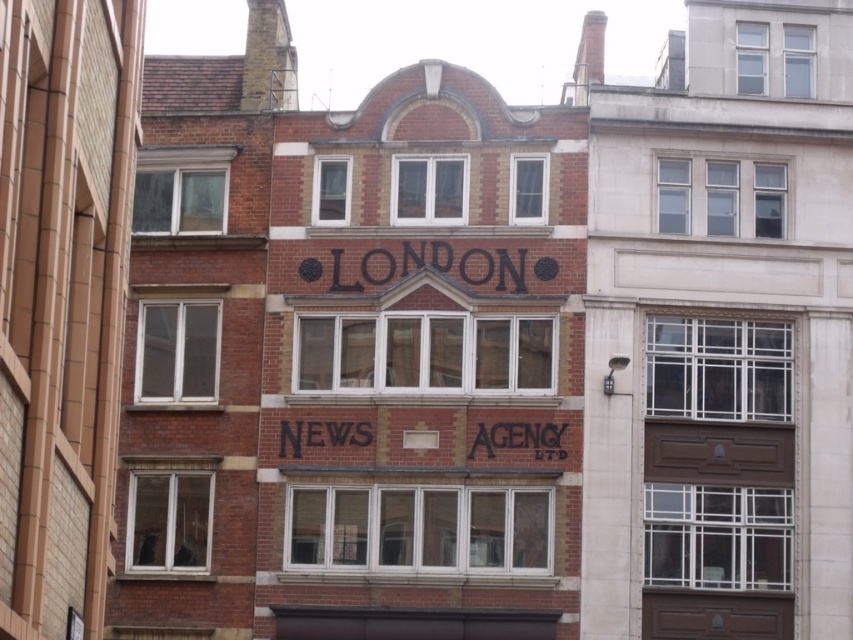
Which is more to the right, black painted letters at center or black painted sign at center?

black painted sign at center is more to the right.

Is black painted letters at center smaller than black painted sign at center?

Yes, black painted letters at center is smaller than black painted sign at center.

Who is more forward, (485, 257) or (556, 442)?

Positioned in front is point (556, 442).

This screenshot has width=853, height=640. Identify the location of black painted letters at center. (432, 266).